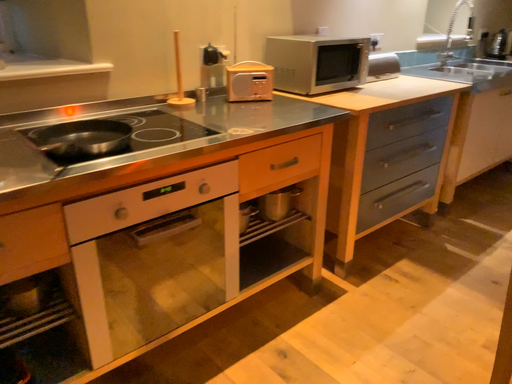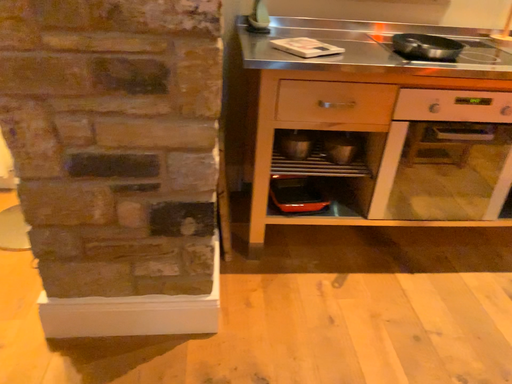
Question: How did the camera likely rotate when shooting the video?

Choices:
 (A) rotated right
 (B) rotated left

Answer: (B)